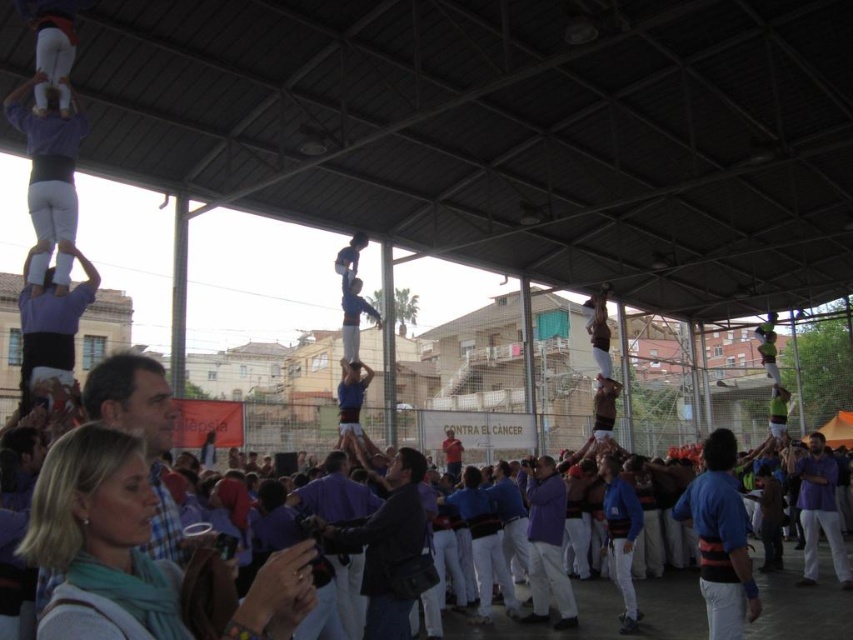
You are a photographer at the event and want to capture a photo that includes both the matte white pants at upper left and the white cotton shirt at center. Based on their positions, which one should be closer to the camera to ensure both are in focus?

The matte white pants at upper left is in front of the white cotton shirt at center, so to ensure both are in focus, the matte white pants at upper left should be closer to the camera.

You are a photographer at the event and want to capture a photo of the white cotton shirt at center without the matte white pants at upper left blocking the view. Is this possible?

The matte white pants at upper left is above the white cotton shirt at center, so it will block the view. You need to adjust your angle or position to avoid it.